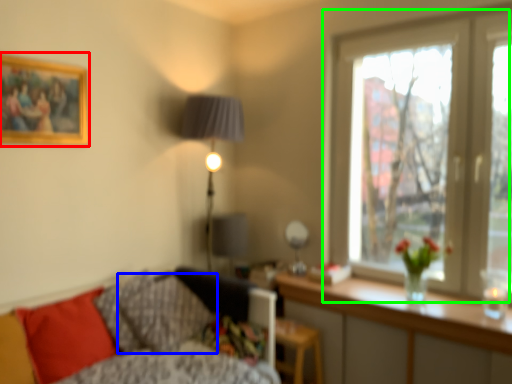
Question: Which object is positioned closest to picture frame (highlighted by a red box)? Select from pillow (highlighted by a blue box) and window (highlighted by a green box).

Choices:
 (A) pillow
 (B) window

Answer: (A)